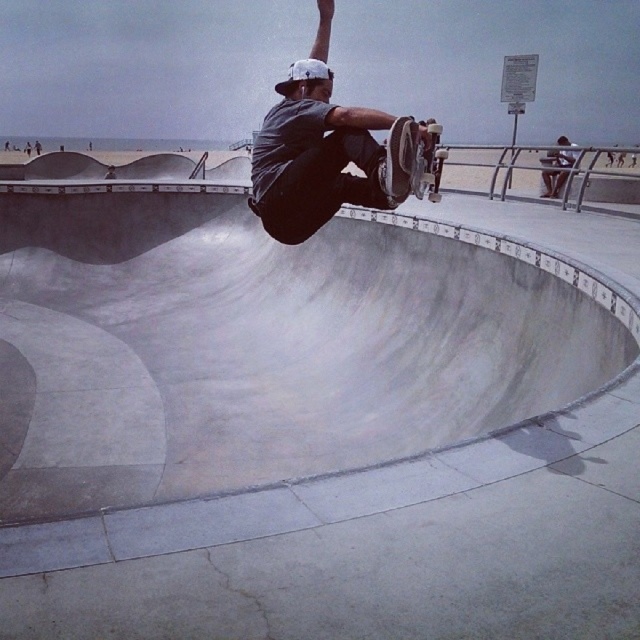
At what (x,y) coordinates should I click in order to perform the action: click on matte gray shirt at center. Please return your answer as a coordinate pair (x, y). Looking at the image, I should click on (317, 150).

What do you see at coordinates (317, 150) in the screenshot?
I see `matte gray shirt at center` at bounding box center [317, 150].

I want to click on matte gray shirt at center, so click(x=317, y=150).